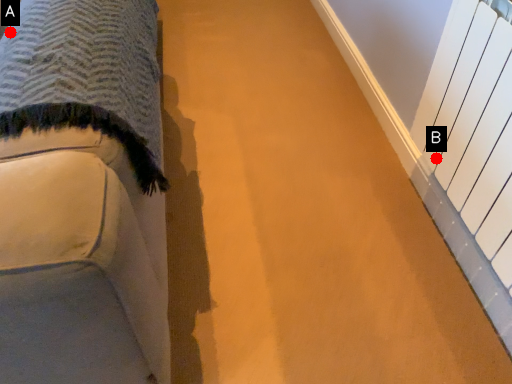
Question: Two points are circled on the image, labeled by A and B beside each circle. Which point is closer to the camera taking this photo?

Choices:
 (A) A is closer
 (B) B is closer

Answer: (A)